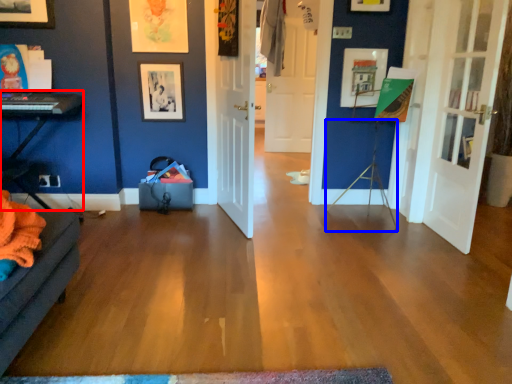
Question: Which object is further to the camera taking this photo, table (highlighted by a red box) or tripod (highlighted by a blue box)?

Choices:
 (A) table
 (B) tripod

Answer: (B)